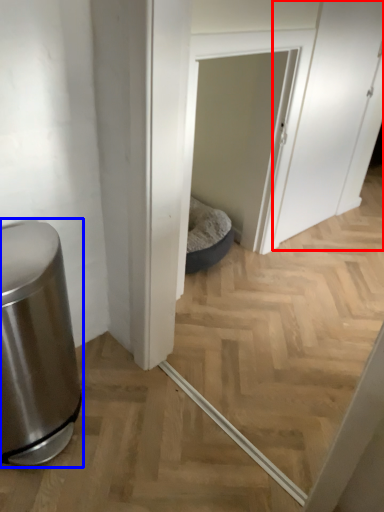
Question: Which of the following is the farthest to the observer, screen door (highlighted by a red box) or waste container (highlighted by a blue box)?

Choices:
 (A) screen door
 (B) waste container

Answer: (A)